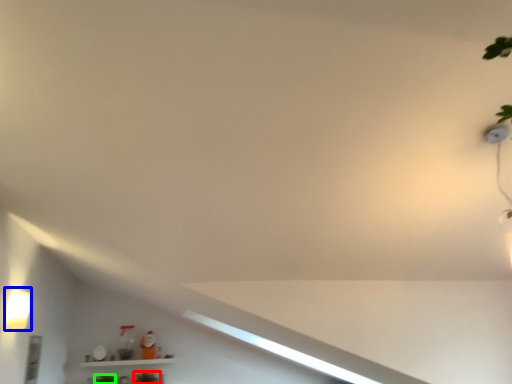
Question: Which object is positioned closest to plant (highlighted by a red box)? Select from light fixture (highlighted by a blue box) and plant (highlighted by a green box).

Choices:
 (A) light fixture
 (B) plant

Answer: (B)